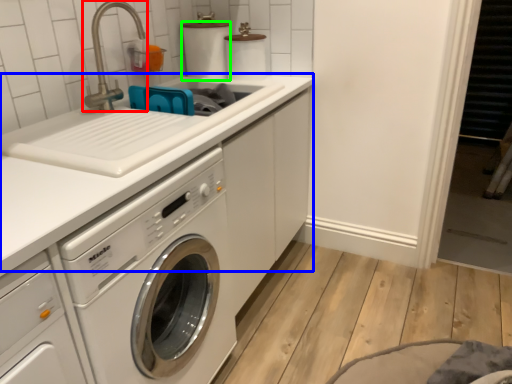
Question: Which object is positioned farthest from faucet (highlighted by a red box)? Select from counter top (highlighted by a blue box) and toilet paper (highlighted by a green box).

Choices:
 (A) counter top
 (B) toilet paper

Answer: (A)